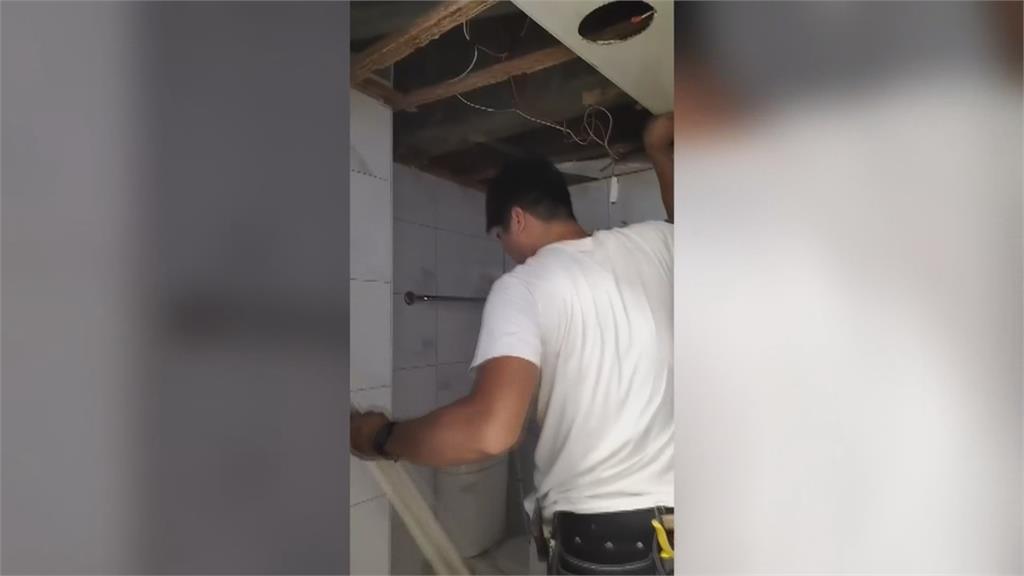
I want to click on wall above metal rod, so click(x=463, y=252).